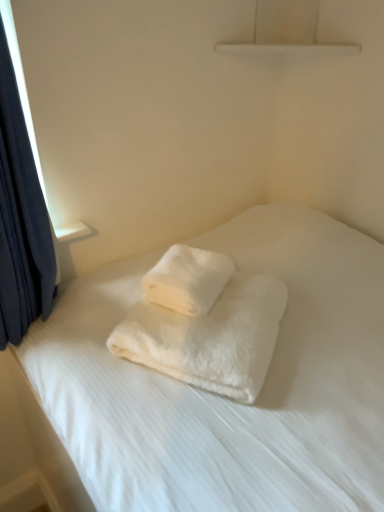
Locate an element on the screen. vacant space to the right of white fluffy towel at center, which is the 1th towel from top to bottom is located at coordinates (269, 276).